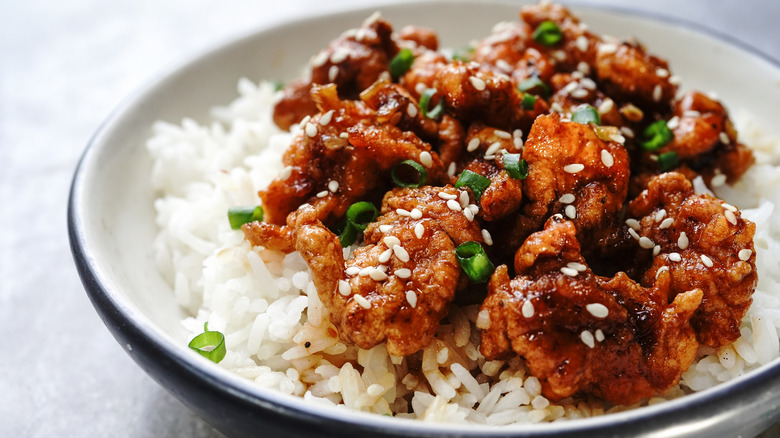
This screenshot has height=438, width=780. I want to click on table, so click(30, 321).